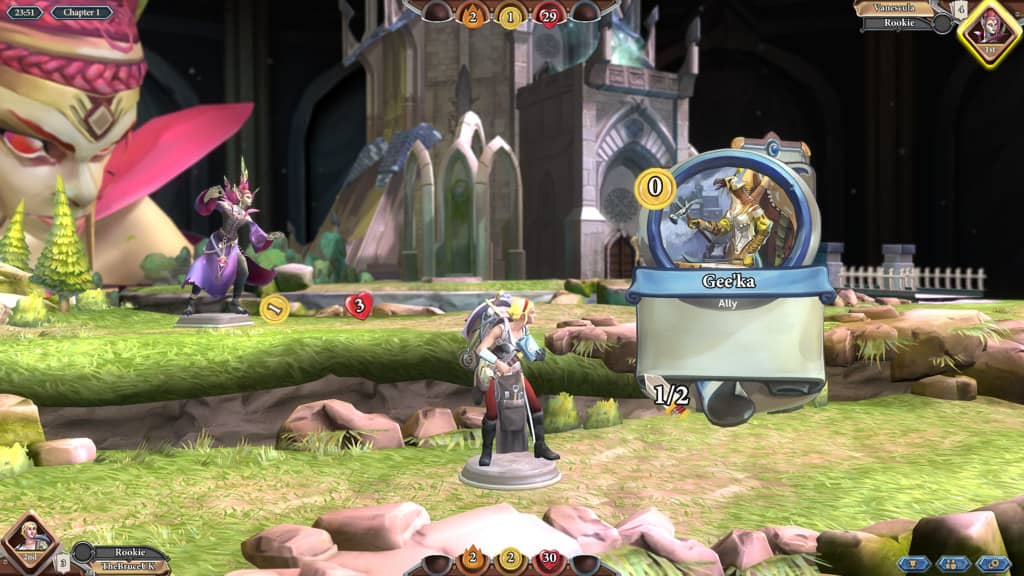
This screenshot has width=1024, height=576. I want to click on window, so click(x=620, y=209).